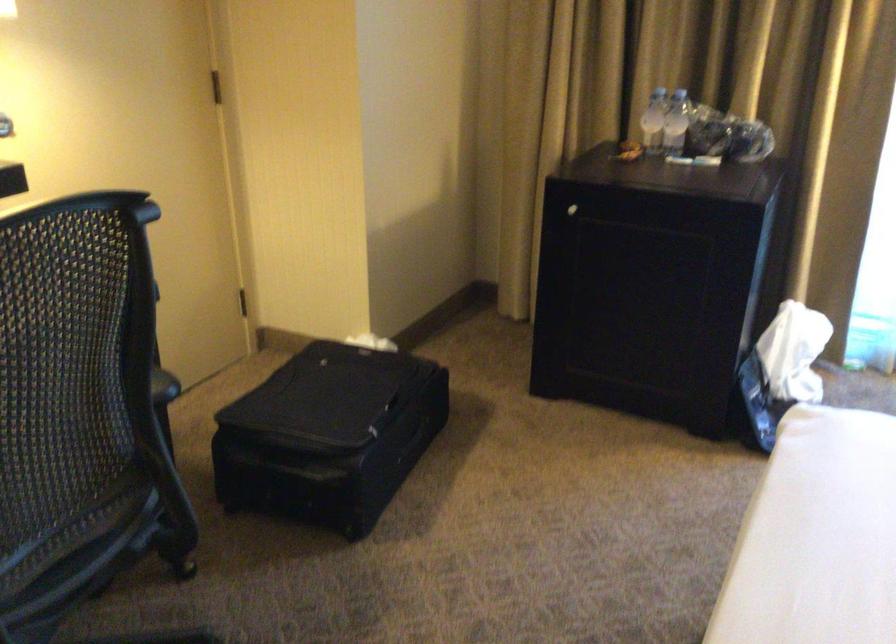
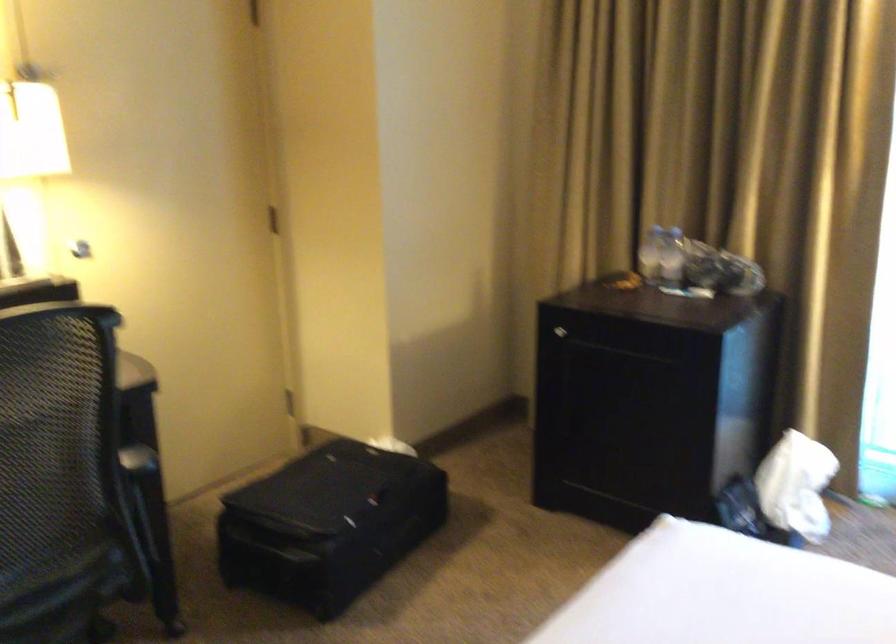
The point at (346,436) is marked in the first image. Where is the corresponding point in the second image?

(328, 524)